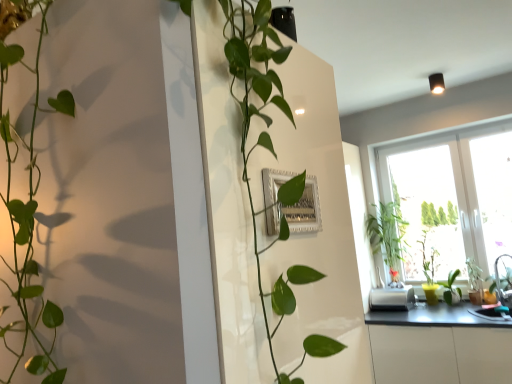
Question: From the image's perspective, does green matte plant at right, which is the 1th plant in right-to-left order, appear lower than transparent glass window at right?

Choices:
 (A) yes
 (B) no

Answer: (A)

Question: Is green matte plant at right, the second plant when ordered from left to right, completely or partially outside of transparent glass window at right?

Choices:
 (A) no
 (B) yes

Answer: (A)

Question: Does green matte plant at right, which is the 1th plant in right-to-left order, have a greater height compared to transparent glass window at right?

Choices:
 (A) yes
 (B) no

Answer: (B)

Question: Is green matte plant at right, which is the 1th plant in right-to-left order, further to the viewer compared to transparent glass window at right?

Choices:
 (A) no
 (B) yes

Answer: (B)

Question: Is transparent glass window at right at the back of green matte plant at right, the second plant when ordered from left to right?

Choices:
 (A) yes
 (B) no

Answer: (A)

Question: Can transparent glass window at right be found inside green matte plant at right, the second plant when ordered from left to right?

Choices:
 (A) no
 (B) yes

Answer: (A)

Question: Are green matte plant at right, which is the 1th plant in right-to-left order, and green glossy plant at left, which is the 2th houseplant from right to left, beside each other?

Choices:
 (A) no
 (B) yes

Answer: (A)

Question: Does green matte plant at right, which is the 1th plant in right-to-left order, come in front of green glossy plant at left, arranged as the second houseplant when viewed from the back?

Choices:
 (A) no
 (B) yes

Answer: (A)

Question: Is green matte plant at right, which is the 1th plant in right-to-left order, turned away from green glossy plant at left, arranged as the second houseplant when viewed from the back?

Choices:
 (A) yes
 (B) no

Answer: (B)

Question: Does green matte plant at right, which is the 1th plant in right-to-left order, have a greater width compared to green glossy plant at left, the first houseplant from the front?

Choices:
 (A) no
 (B) yes

Answer: (A)

Question: From a real-world perspective, is green matte plant at right, which is the 1th plant in right-to-left order, positioned over green glossy plant at left, the first houseplant from the front, based on gravity?

Choices:
 (A) yes
 (B) no

Answer: (B)

Question: From the image's perspective, does green matte plant at right, which is the 1th plant in right-to-left order, appear higher than green glossy plant at left, the first houseplant from the front?

Choices:
 (A) no
 (B) yes

Answer: (A)

Question: From a real-world perspective, is white plastic toaster at lower right physically above green glossy plant at left, the first houseplant from the front?

Choices:
 (A) no
 (B) yes

Answer: (A)